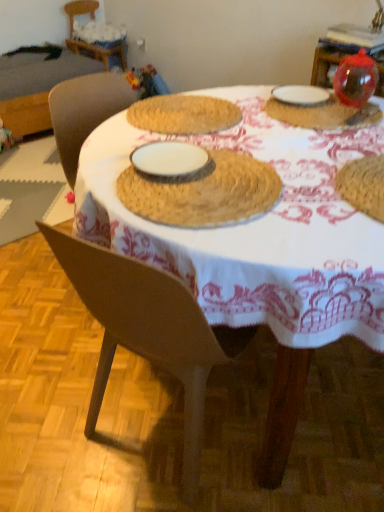
Question: Visually, is wooden chair at upper left positioned to the left or to the right of woven straw placemat at center, arranged as the first table when viewed from the right?

Choices:
 (A) right
 (B) left

Answer: (B)

Question: From the image's perspective, is wooden chair at upper left above or below woven straw placemat at center, positioned as the 1th table in front-to-back order?

Choices:
 (A) below
 (B) above

Answer: (B)

Question: Considering the real-world distances, which object is closest to the wooden chair at upper left?

Choices:
 (A) transparent plastic ball at upper right, the 2th tableware in the right-to-left sequence
 (B) woven straw placemat at upper left, arranged as the first table when viewed from the left
 (C) transparent plastic ornament at upper right, the third tableware from the left
 (D) white ceramic plate at upper right, the first tableware viewed from the left
 (E) woven straw placemat at center, which is counted as the 2th table, starting from the back

Answer: (B)

Question: Considering the real-world distances, which object is closest to the wooden chair at upper left?

Choices:
 (A) white ceramic plate at upper right, the first tableware viewed from the left
 (B) woven straw placemat at upper left, the 1th table positioned from the top
 (C) woven straw placemat at center, positioned as the 1th table in front-to-back order
 (D) transparent plastic ornament at upper right, the third tableware from the left
 (E) transparent plastic ball at upper right, the 2th tableware in the right-to-left sequence

Answer: (B)